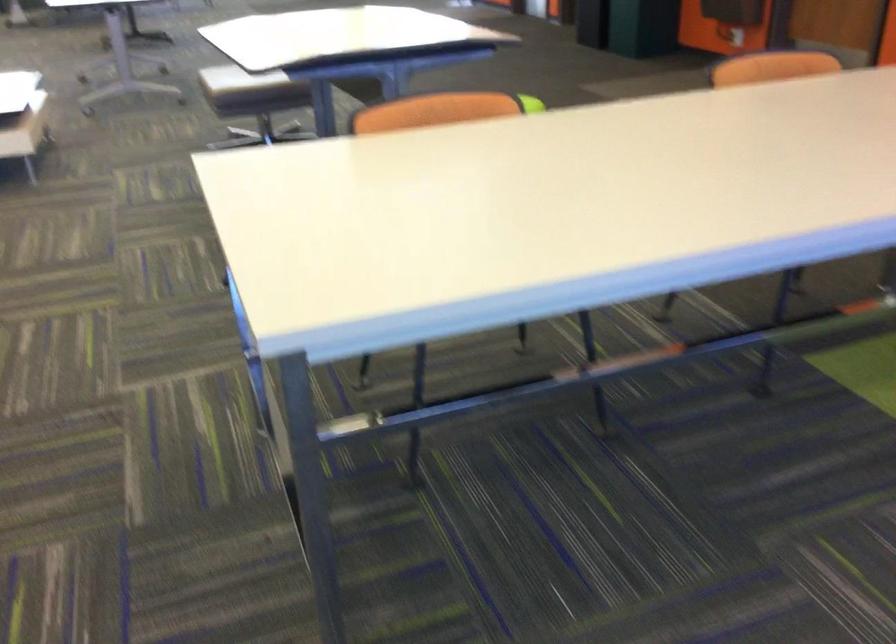
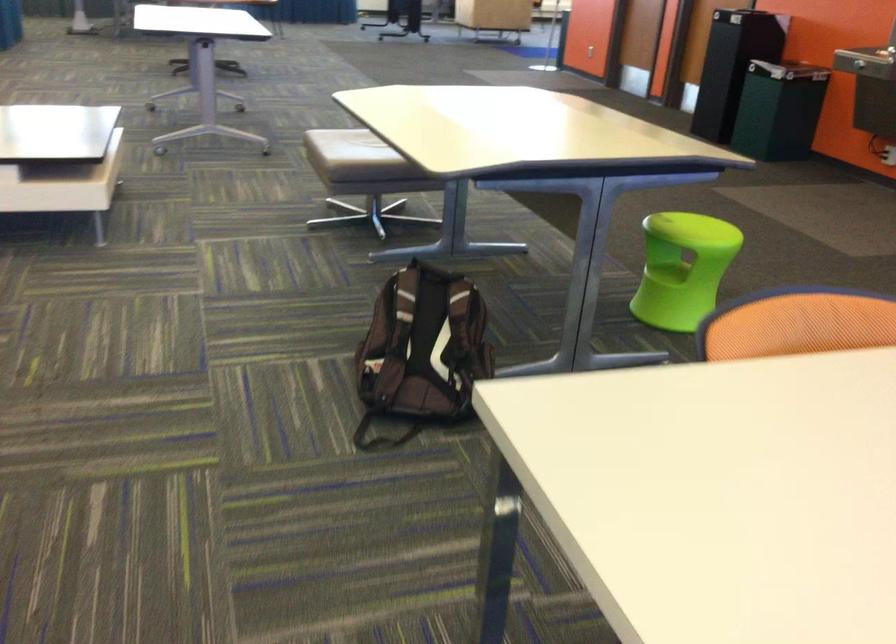
The images are taken continuously from a first-person perspective. In which direction are you moving?

The cameraman walked toward left, forward.